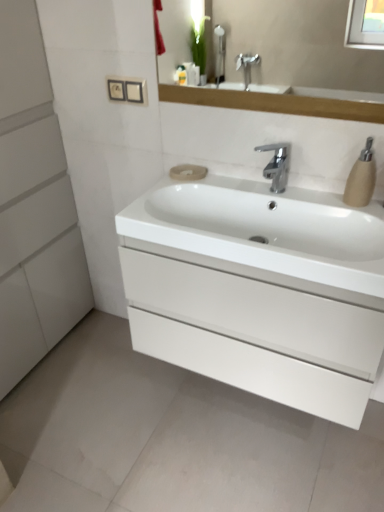
Question: From a real-world perspective, is beige matte soap dispenser at right physically located above or below white glossy drawer at center?

Choices:
 (A) above
 (B) below

Answer: (A)

Question: Considering their positions, is beige matte soap dispenser at right located in front of or behind white glossy drawer at center?

Choices:
 (A) behind
 (B) front

Answer: (A)

Question: Estimate the real-world distances between objects in this image. Which object is closer to the beige matte soap at center?

Choices:
 (A) beige matte soap dispenser at right
 (B) polished chrome faucet at center
 (C) white glossy drawer at center
 (D) white matte cabinet at left
 (E) white glossy sink at center

Answer: (B)

Question: Based on their relative distances, which object is nearer to the white glossy sink at center?

Choices:
 (A) beige matte soap at center
 (B) white glossy drawer at center
 (C) beige matte soap dispenser at right
 (D) polished chrome faucet at center
 (E) white matte cabinet at left

Answer: (B)